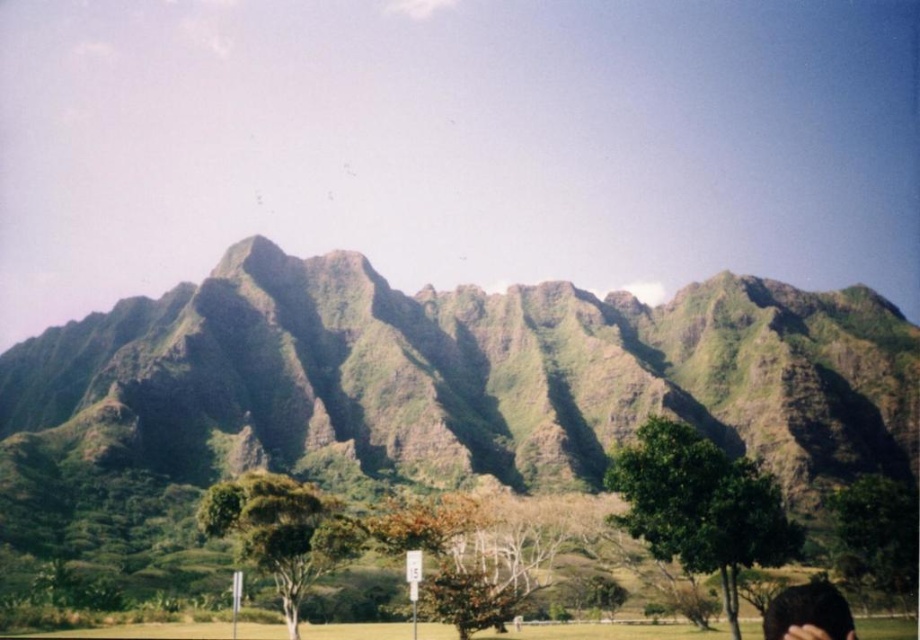
You are a hiker who wants to place a 100 meter long banner between the green rough mountain at center and the dark brown hair at lower right. Can you do it?

The distance between the green rough mountain at center and the dark brown hair at lower right is 77.38 meters, so the banner cannot be placed as it is longer than the available space.

You are a hiker planning to take a photo of the green rough mountain at center and the dark brown hair at lower right. Which object should you focus on first if you want both to be in sharp focus?

The green rough mountain at center is taller than the dark brown hair at lower right, so you should focus on the green rough mountain at center first to ensure both are in sharp focus.

You are a hiker planning to take a photo of the green rough mountain at center and the dark brown hair at lower right. Which object should you focus on first if you want both to be in clear focus?

The green rough mountain at center is bigger than the dark brown hair at lower right, so you should focus on the green rough mountain at center first to ensure both are in clear focus.